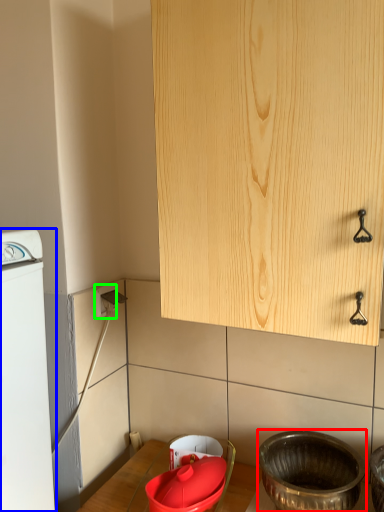
Question: Based on their relative distances, which object is nearer to basin (highlighted by a red box)? Choose from home appliance (highlighted by a blue box) and electric outlet (highlighted by a green box).

Choices:
 (A) home appliance
 (B) electric outlet

Answer: (A)